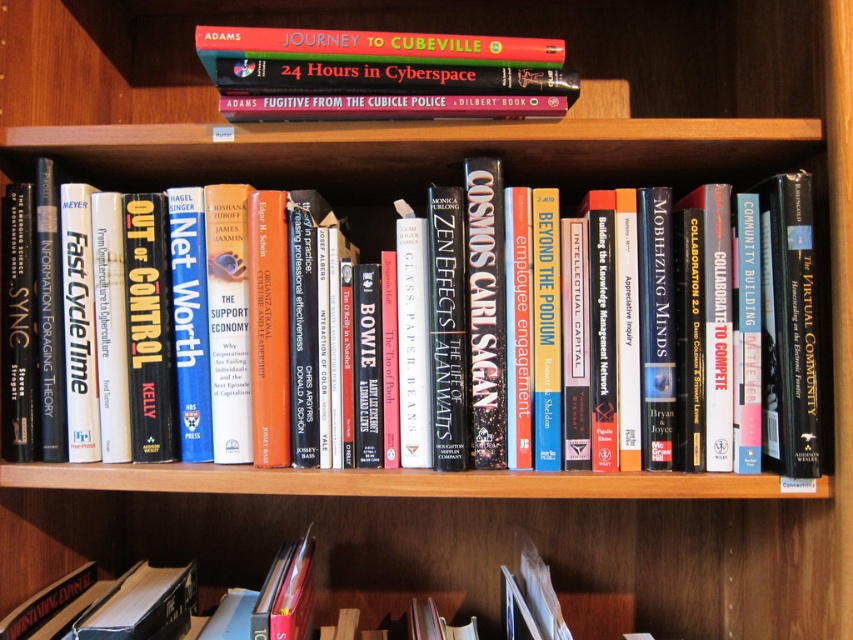
Can you confirm if hardcover book at center is wider than hardcover book at upper center?

Yes.

Can you confirm if hardcover book at center is positioned below hardcover book at upper center?

Yes.

In order to click on hardcover book at center in this screenshot , I will do `click(457, 184)`.